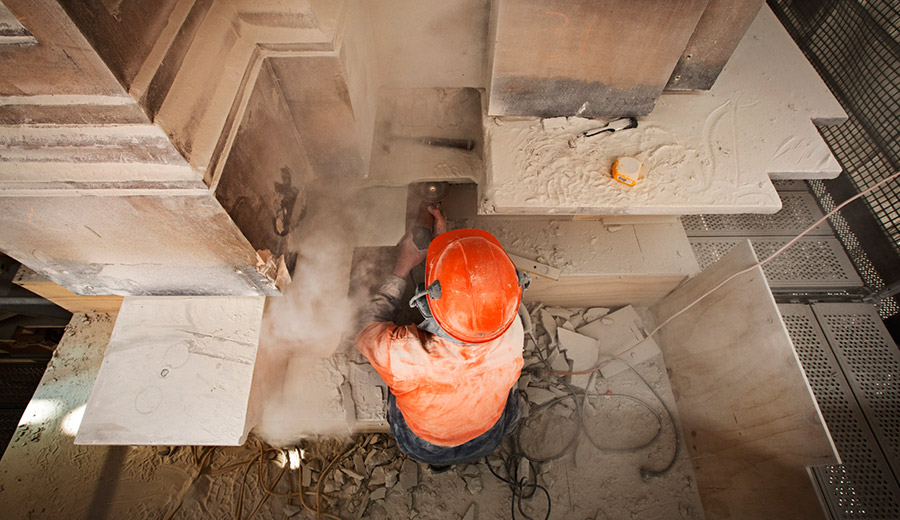
At what (x,y) coordinates should I click in order to perform the action: click on cords. Please return your answer as a coordinate pair (x, y). The width and height of the screenshot is (900, 520). Looking at the image, I should click on (657, 328), (651, 388), (506, 481), (325, 464).